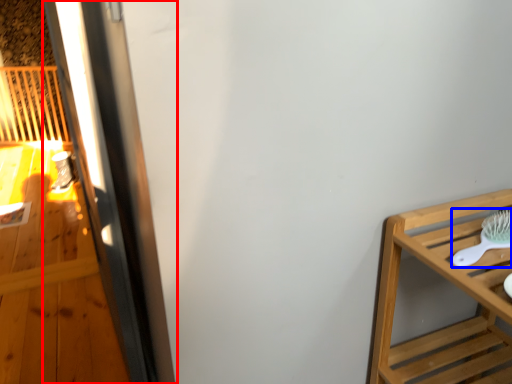
Question: Which object appears closest to the camera in this image, screen door (highlighted by a red box) or brush (highlighted by a blue box)?

Choices:
 (A) screen door
 (B) brush

Answer: (B)